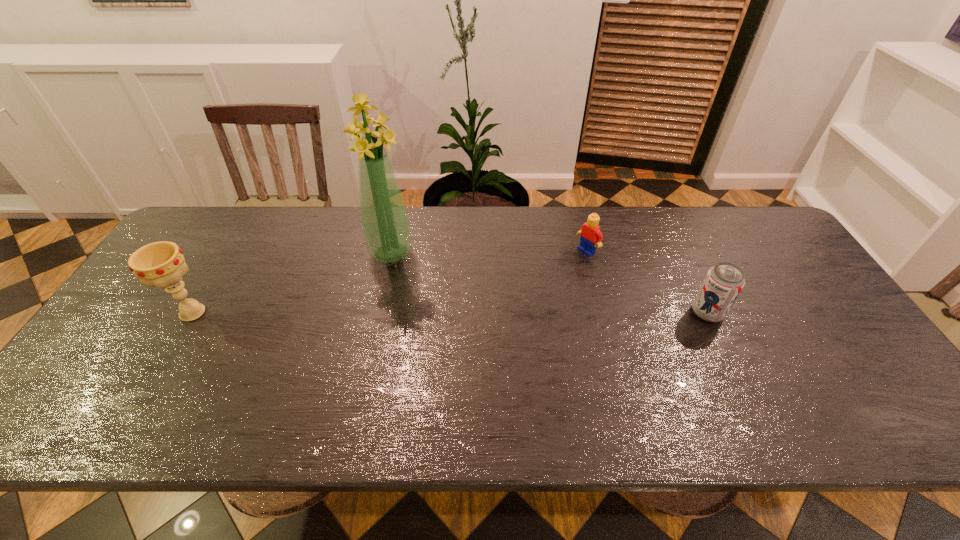
You are a GUI agent. You are given a task and a screenshot of the screen. Output one action in this format:
    pyautogui.click(x=<x>, y=<y>)
    Task: Click on the vacant spot on the desktop that is between the leftmost object and the rightmost object and is positioned on the front-facing side of the bouquet
    Image resolution: width=960 pixels, height=540 pixels.
    Given the screenshot: What is the action you would take?
    pyautogui.click(x=415, y=313)

Locate an element on the screen. free space on the desktop that is between the leftmost object and the rightmost object and is positioned on the face of the Lego is located at coordinates (492, 313).